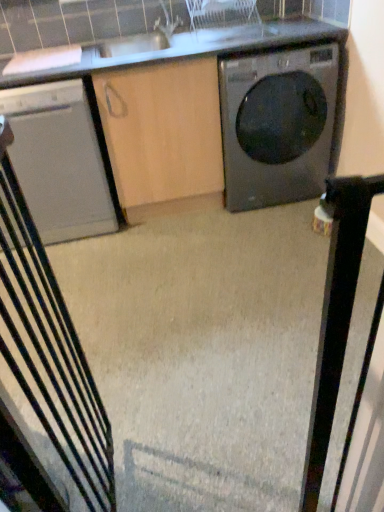
Question: Can you confirm if white glossy countertop at upper center is taller than satin white dishwasher at left?

Choices:
 (A) no
 (B) yes

Answer: (A)

Question: Is white glossy countertop at upper center looking in the opposite direction of satin white dishwasher at left?

Choices:
 (A) no
 (B) yes

Answer: (A)

Question: Can you confirm if white glossy countertop at upper center is shorter than satin white dishwasher at left?

Choices:
 (A) yes
 (B) no

Answer: (A)

Question: Does white glossy countertop at upper center have a larger size compared to satin white dishwasher at left?

Choices:
 (A) no
 (B) yes

Answer: (A)

Question: Is white glossy countertop at upper center in front of satin white dishwasher at left?

Choices:
 (A) no
 (B) yes

Answer: (B)

Question: Is point click(11, 54) positioned closer to the camera than point click(243, 99)?

Choices:
 (A) closer
 (B) farther

Answer: (B)

Question: In terms of height, does white glossy countertop at upper center look taller or shorter compared to matte black washing machine at right?

Choices:
 (A) tall
 (B) short

Answer: (B)

Question: From a real-world perspective, is white glossy countertop at upper center physically located above or below matte black washing machine at right?

Choices:
 (A) below
 (B) above

Answer: (B)

Question: Visually, is white glossy countertop at upper center positioned to the left or to the right of matte black washing machine at right?

Choices:
 (A) left
 (B) right

Answer: (A)

Question: Considering the relative positions of matte black washing machine at right and white glossy countertop at upper center in the image provided, is matte black washing machine at right to the left or to the right of white glossy countertop at upper center?

Choices:
 (A) left
 (B) right

Answer: (B)

Question: Is matte black washing machine at right spatially inside white glossy countertop at upper center, or outside of it?

Choices:
 (A) outside
 (B) inside

Answer: (A)

Question: Considering the positions of point (240, 122) and point (99, 4), is point (240, 122) closer or farther from the camera than point (99, 4)?

Choices:
 (A) farther
 (B) closer

Answer: (A)

Question: Relative to white glossy countertop at upper center, is matte black washing machine at right in front or behind?

Choices:
 (A) front
 (B) behind

Answer: (B)

Question: Visually, is white glossy countertop at upper center positioned to the left or to the right of metallic gray rocking chair at left?

Choices:
 (A) right
 (B) left

Answer: (A)

Question: Is white glossy countertop at upper center wider or thinner than metallic gray rocking chair at left?

Choices:
 (A) wide
 (B) thin

Answer: (A)